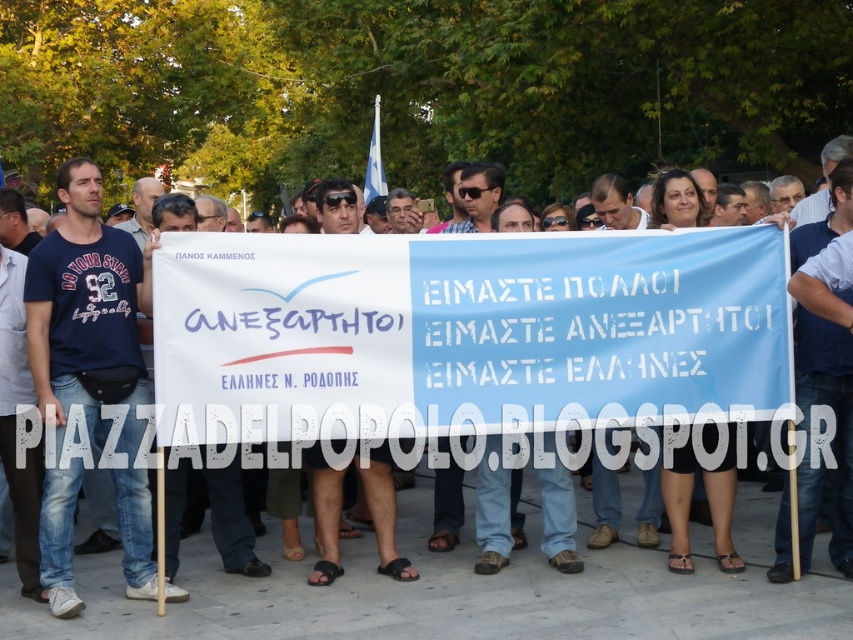
Which is more to the left, matte blue t-shirt at center or blue fabric flag at center?

matte blue t-shirt at center

Which is more to the right, matte blue t-shirt at center or blue fabric flag at center?

Positioned to the right is blue fabric flag at center.

Does point (119, 387) come behind point (791, 273)?

No, (119, 387) is closer to viewer.

Find the location of a particular element. matte blue t-shirt at center is located at coordinates point(94,346).

Between white paper banner at center and blue fabric flag at center, which one appears on the right side from the viewer's perspective?

blue fabric flag at center

Is white paper banner at center behind blue fabric flag at center?

No, white paper banner at center is closer to the viewer.

Is point (465, 422) more distant than point (809, 385)?

No, (465, 422) is in front of (809, 385).

Locate an element on the screen. The height and width of the screenshot is (640, 853). white paper banner at center is located at coordinates (474, 362).

Who is positioned more to the left, white paper banner at center or matte blue t-shirt at center?

matte blue t-shirt at center

Between point (262, 353) and point (114, 420), which one is positioned behind?

Point (114, 420)

The image size is (853, 640). What do you see at coordinates (474, 362) in the screenshot? I see `white paper banner at center` at bounding box center [474, 362].

Identify the location of white paper banner at center. (474, 362).